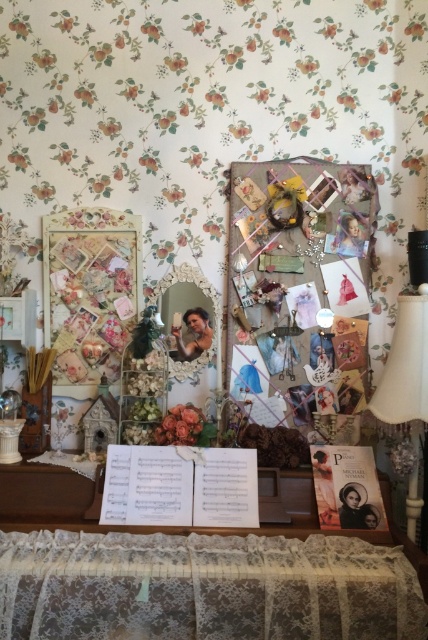
Question: Which is farther from the matte floral bouquet at center?

Choices:
 (A) floral paper collage at left
 (B) wooden table at center

Answer: (A)

Question: Which point is closer to the camera taking this photo?

Choices:
 (A) (329, 561)
 (B) (296, 483)
 (C) (401, 378)

Answer: (A)

Question: Estimate the real-world distances between objects in this image. Which object is closer to the floral paper collage at left?

Choices:
 (A) white fabric lampshade at right
 (B) gold ornate mirror at center
 (C) wooden table at center

Answer: (B)

Question: In this image, where is wooden table at center located relative to white fabric lampshade at right?

Choices:
 (A) above
 (B) below

Answer: (B)

Question: Observing the image, what is the correct spatial positioning of floral paper collage at left in reference to wooden table at center?

Choices:
 (A) below
 (B) above

Answer: (B)

Question: Does lace fabric tablecloth at lower center appear on the right side of matte floral bouquet at center?

Choices:
 (A) yes
 (B) no

Answer: (A)